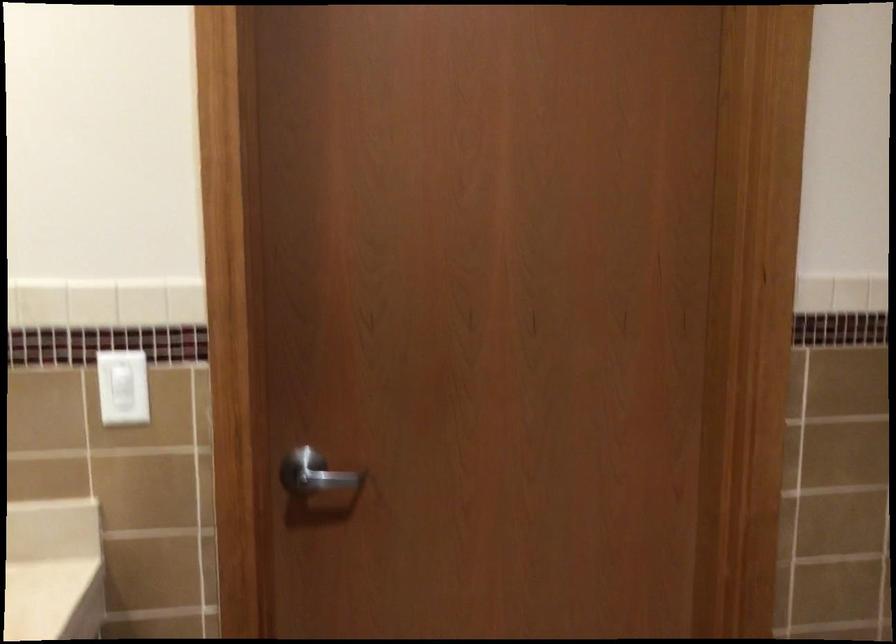
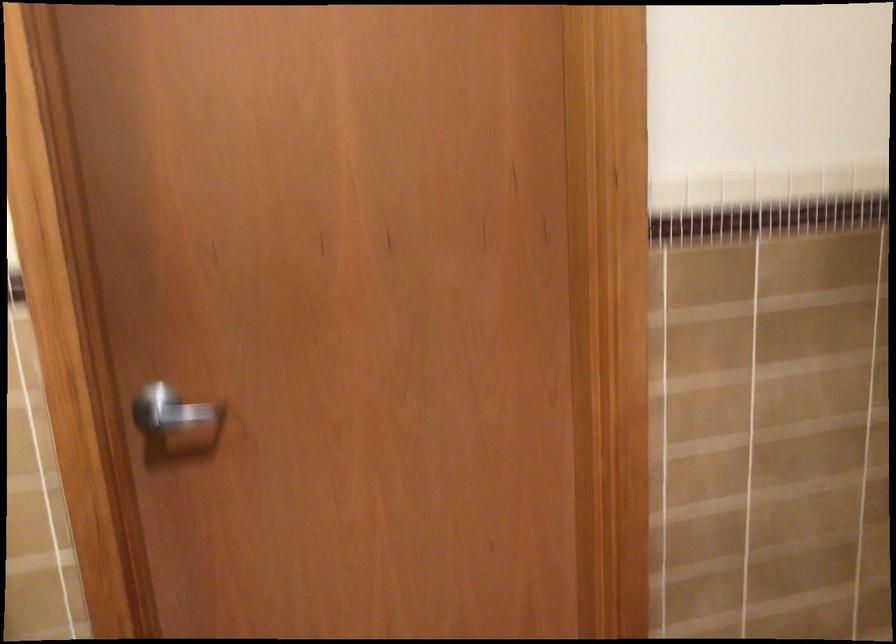
Question: What movement of the cameraman would produce the second image?

Choices:
 (A) Left
 (B) Right
 (C) Forward
 (D) Backward

Answer: (B)